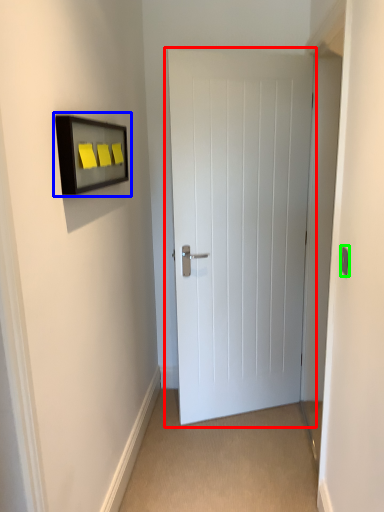
Question: Estimate the real-world distances between objects in this image. Which object is farther from door (highlighted by a red box), medicine cabinet (highlighted by a blue box) or light switch (highlighted by a green box)?

Choices:
 (A) medicine cabinet
 (B) light switch

Answer: (B)